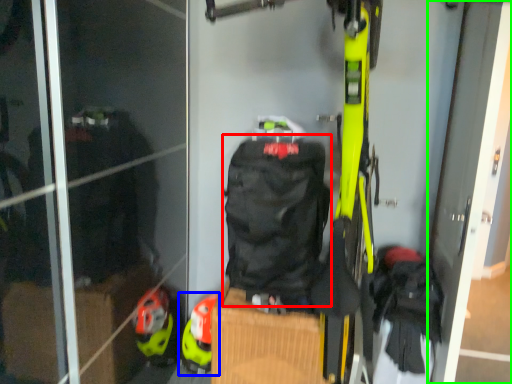
Question: Which object is positioned farthest from backpack (highlighted by a red box)? Select from footwear (highlighted by a blue box) and screen door (highlighted by a green box).

Choices:
 (A) footwear
 (B) screen door

Answer: (B)